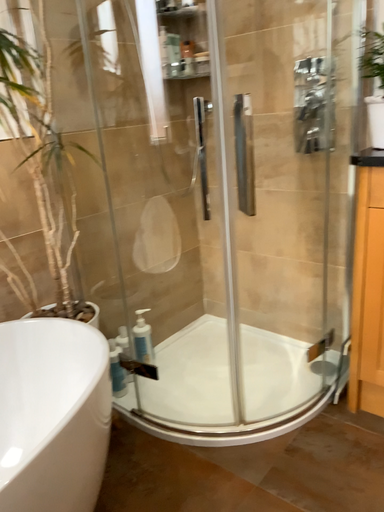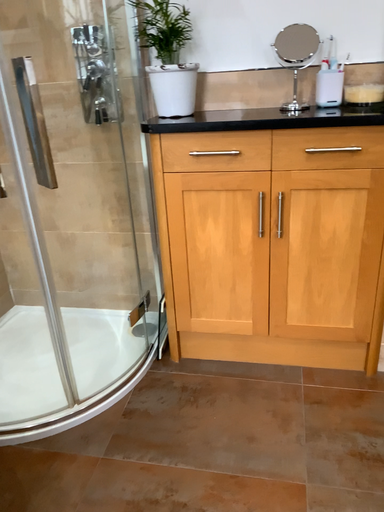
Question: Which way did the camera rotate in the video?

Choices:
 (A) rotated right
 (B) rotated left

Answer: (A)